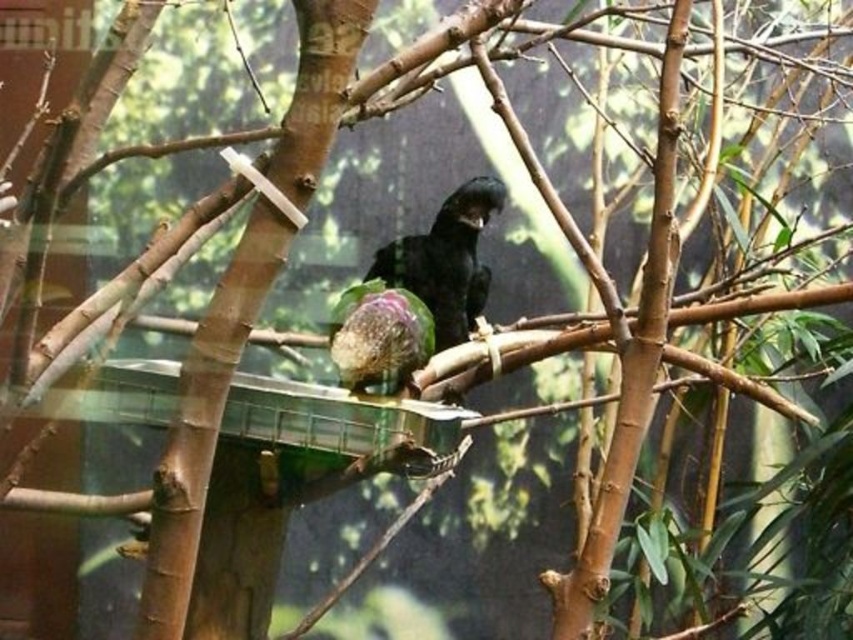
Question: Does shiny black bird at center have a smaller size compared to speckled green parrot at center?

Choices:
 (A) yes
 (B) no

Answer: (B)

Question: Which object is closer to the camera taking this photo?

Choices:
 (A) speckled green parrot at center
 (B) shiny black bird at center

Answer: (A)

Question: Can you confirm if shiny black bird at center is smaller than speckled green parrot at center?

Choices:
 (A) yes
 (B) no

Answer: (B)

Question: Can you confirm if shiny black bird at center is positioned to the right of speckled green parrot at center?

Choices:
 (A) no
 (B) yes

Answer: (B)

Question: Which object appears closest to the camera in this image?

Choices:
 (A) speckled green parrot at center
 (B) shiny black bird at center

Answer: (A)